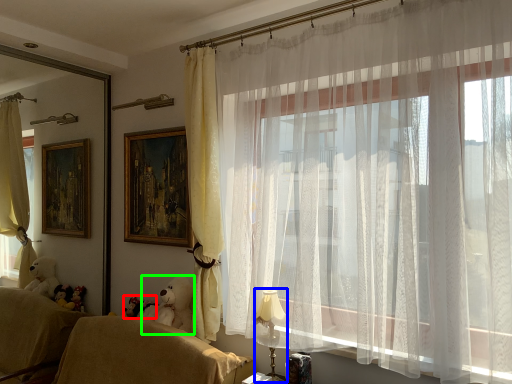
Question: Considering the real-world distances, which object is closest to toy (highlighted by a red box)? table lamp (highlighted by a blue box) or animal (highlighted by a green box).

Choices:
 (A) table lamp
 (B) animal

Answer: (B)